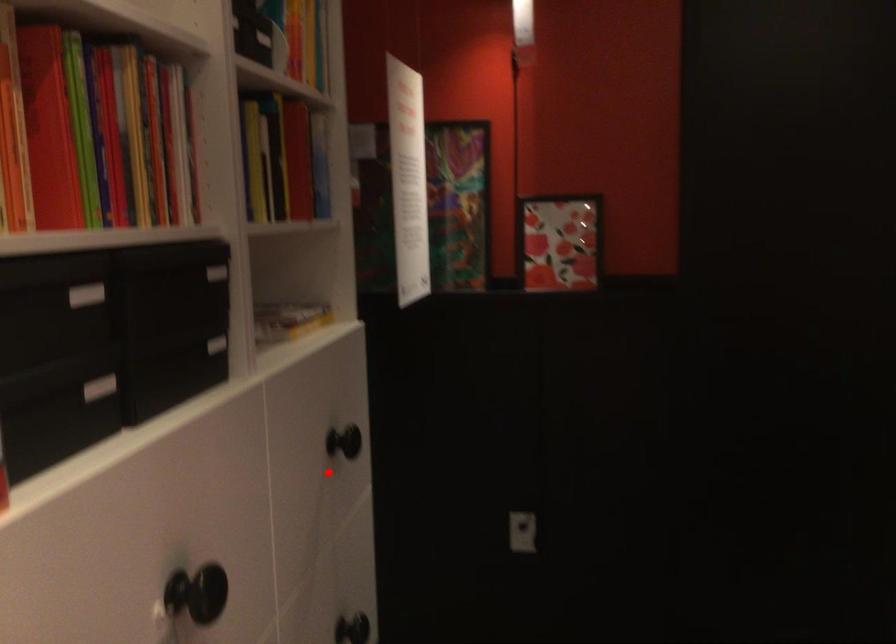
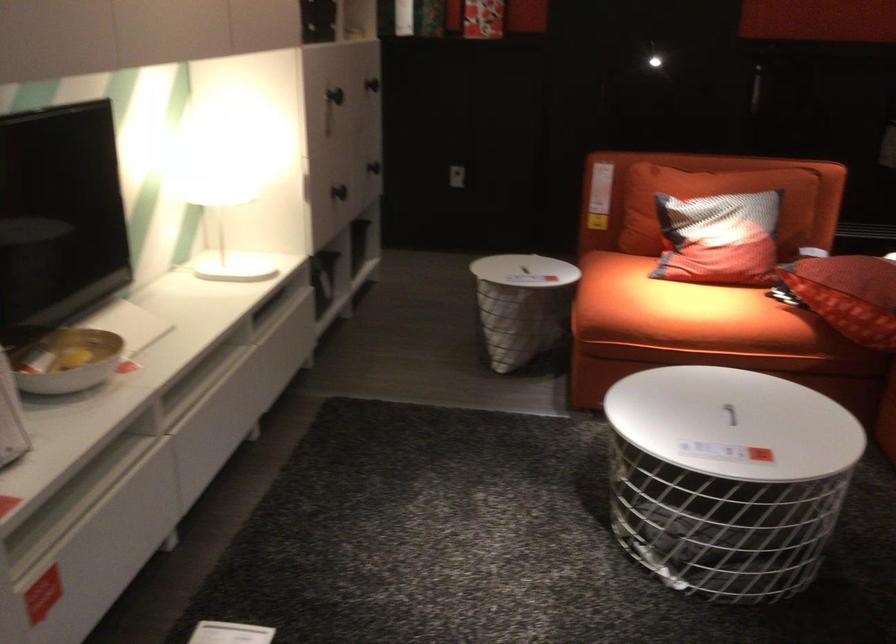
Question: I am providing you with two images of the same scene from different viewpoints. Given a red point in image1, look at the same physical point in image2. Is it:

Choices:
 (A) Closer to the viewpoint
 (B) Farther from the viewpoint

Answer: (B)